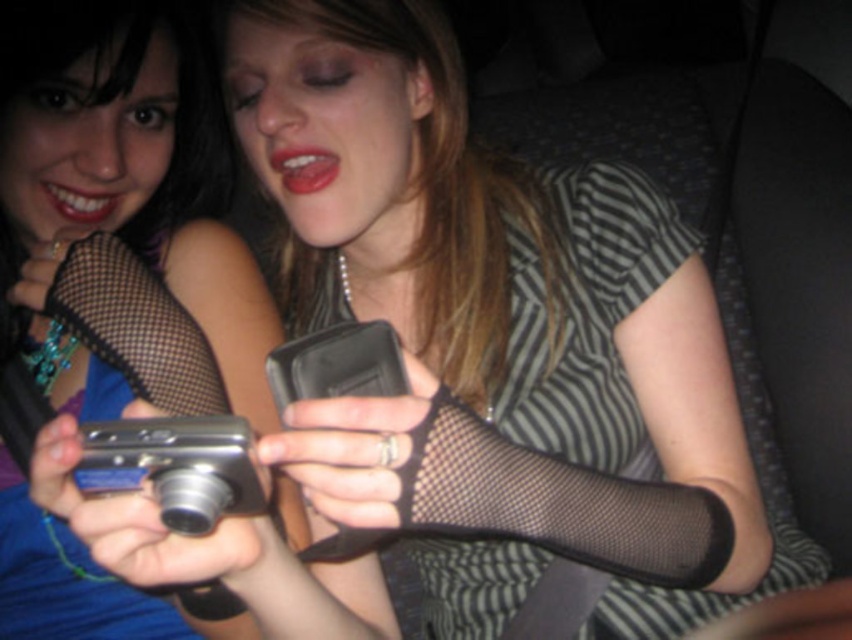
From the picture: Can you confirm if matte black camera at center is positioned to the left of black mesh stocking at center?

Indeed, matte black camera at center is positioned on the left side of black mesh stocking at center.

Is point (62, 381) positioned after point (344, 337)?

Yes, it is behind point (344, 337).

Image resolution: width=852 pixels, height=640 pixels. I want to click on matte black camera at center, so [121, 186].